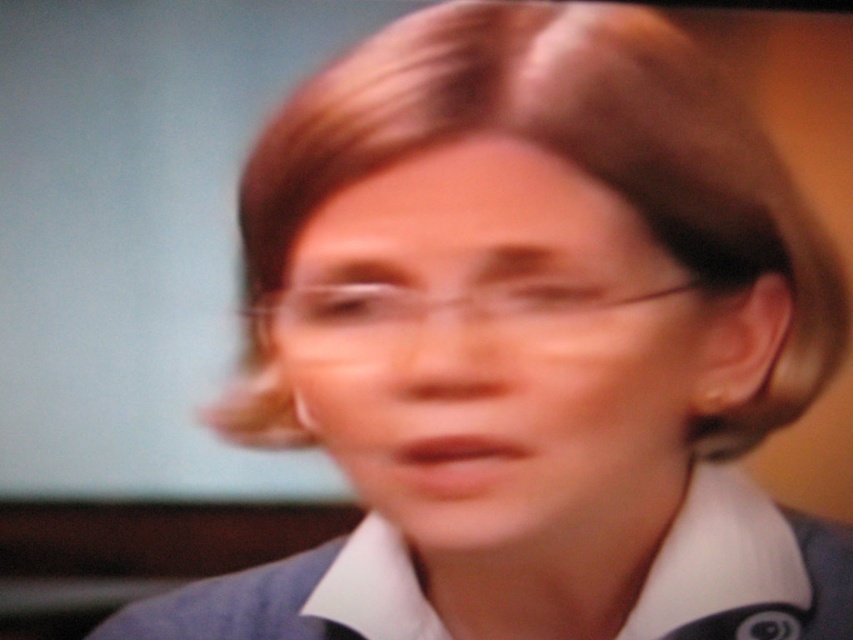
Question: Can you confirm if matte plastic face at center is smaller than clear plastic glasses at center?

Choices:
 (A) yes
 (B) no

Answer: (B)

Question: Based on their relative distances, which object is farther from the matte plastic face at center?

Choices:
 (A) blue woolen blazer at center
 (B) clear plastic glasses at center

Answer: (A)

Question: Which of the following is the closest to the observer?

Choices:
 (A) blue woolen blazer at center
 (B) matte plastic face at center
 (C) clear plastic glasses at center

Answer: (B)

Question: Where is matte plastic face at center located in relation to clear plastic glasses at center in the image?

Choices:
 (A) right
 (B) left

Answer: (A)

Question: Is the position of matte plastic face at center more distant than that of blue woolen blazer at center?

Choices:
 (A) yes
 (B) no

Answer: (B)

Question: Which object appears closest to the camera in this image?

Choices:
 (A) matte plastic face at center
 (B) blue woolen blazer at center
 (C) clear plastic glasses at center

Answer: (A)